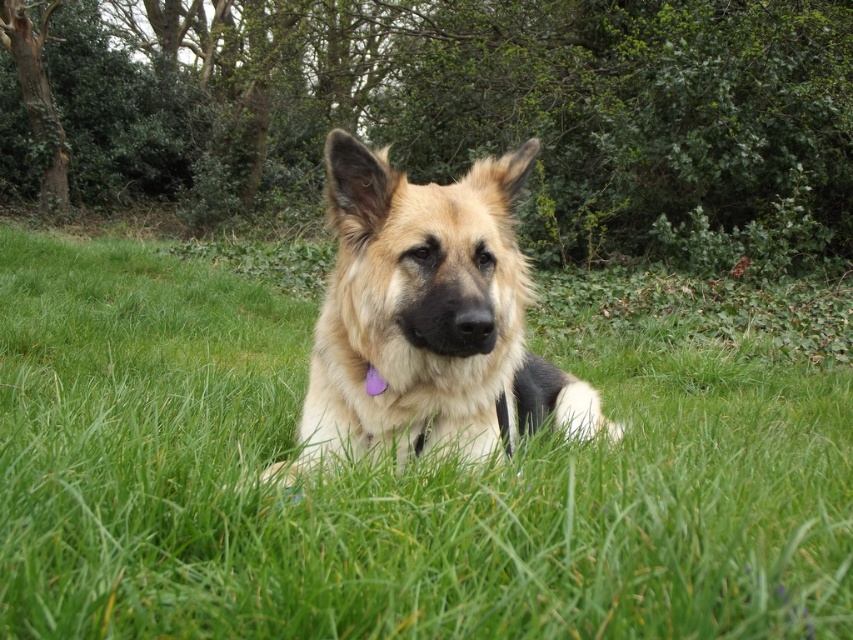
Question: Is green grass at center further to camera compared to golden fur dog at center?

Choices:
 (A) no
 (B) yes

Answer: (B)

Question: Can you confirm if green grass at center is thinner than golden fur dog at center?

Choices:
 (A) no
 (B) yes

Answer: (B)

Question: Which of the following is the closest to the observer?

Choices:
 (A) (378, 198)
 (B) (125, 314)

Answer: (A)

Question: Can you confirm if green grass at center is positioned above golden fur dog at center?

Choices:
 (A) yes
 (B) no

Answer: (B)